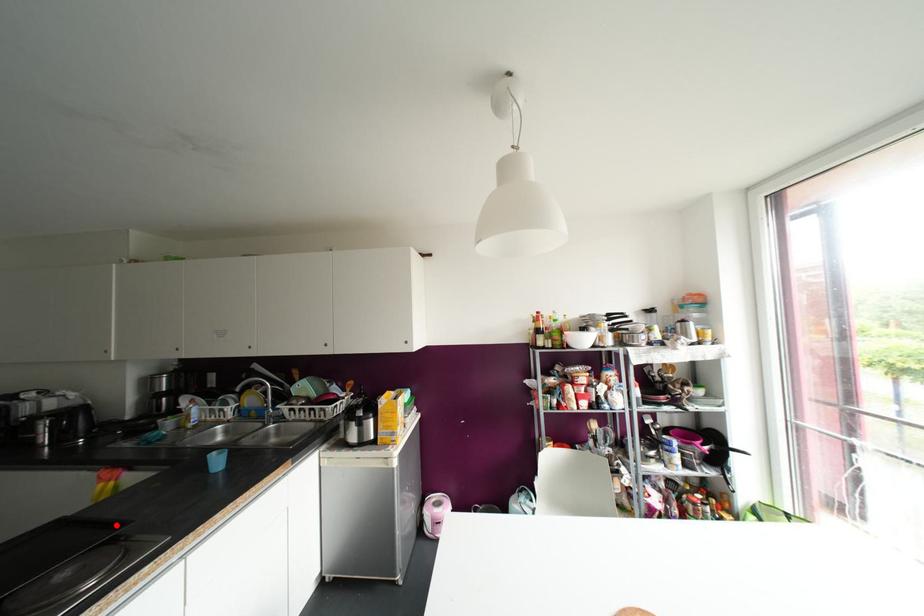
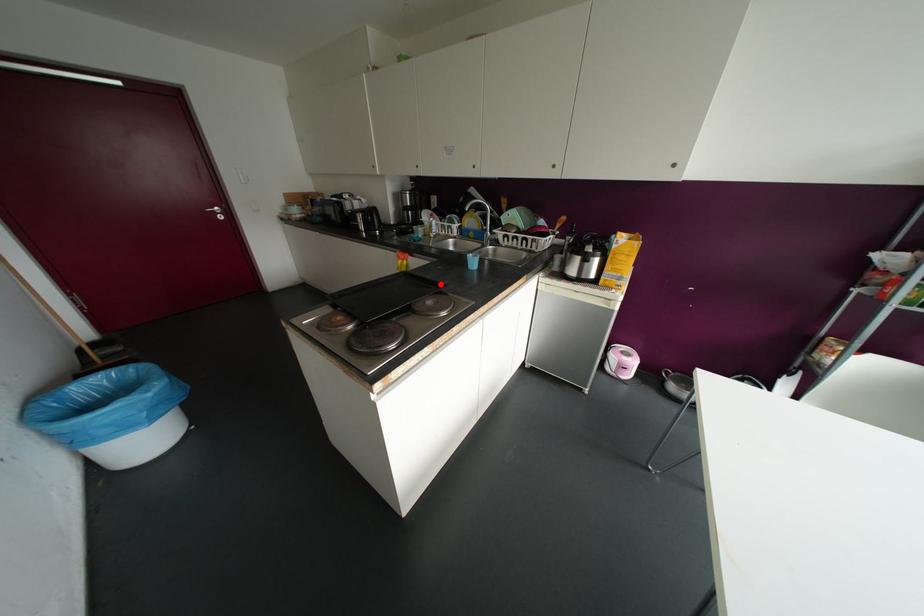
I am providing you with two images of the same scene from different viewpoints. A red point is marked on the first image and another point is marked on the second image. Does the point marked in image1 correspond to the same location as the one in image2?

Yes